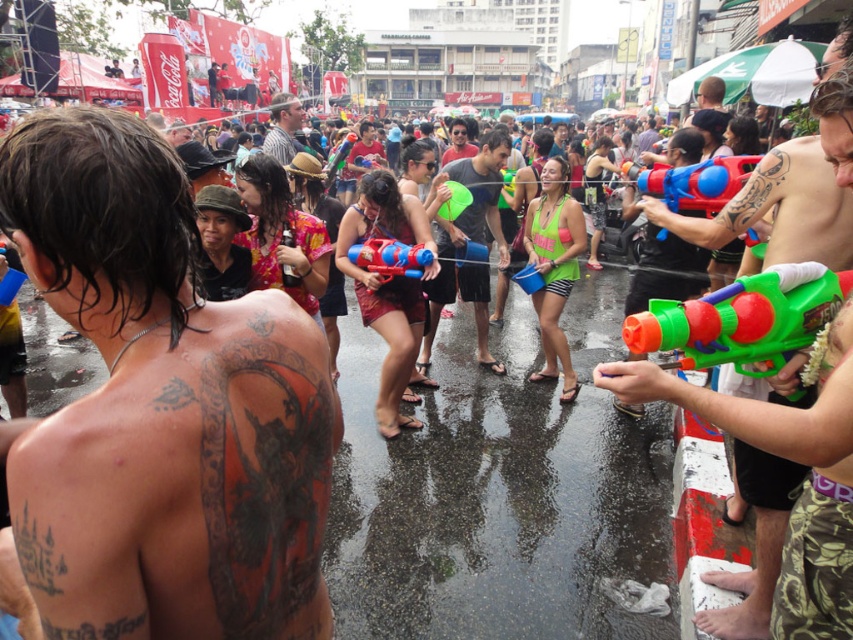
Question: Which object appears closest to the camera in this image?

Choices:
 (A) green plastic water gun at right
 (B) tattooed skin at upper left
 (C) matte green water gun at center

Answer: (B)

Question: Which point appears closest to the camera in this image?

Choices:
 (A) (836, 570)
 (B) (428, 280)

Answer: (A)

Question: Which of the following is the farthest from the observer?

Choices:
 (A) green rubber ball at center
 (B) tattooed skin at upper left

Answer: (A)

Question: Considering the relative positions of matte plastic water gun at upper right and striped fabric hat at center in the image provided, where is matte plastic water gun at upper right located with respect to striped fabric hat at center?

Choices:
 (A) right
 (B) left

Answer: (A)

Question: Does matte plastic water gun at upper right appear under matte blue plastic water gun at center?

Choices:
 (A) no
 (B) yes

Answer: (A)

Question: Is green plastic water gun at right behind striped fabric hat at center?

Choices:
 (A) no
 (B) yes

Answer: (A)